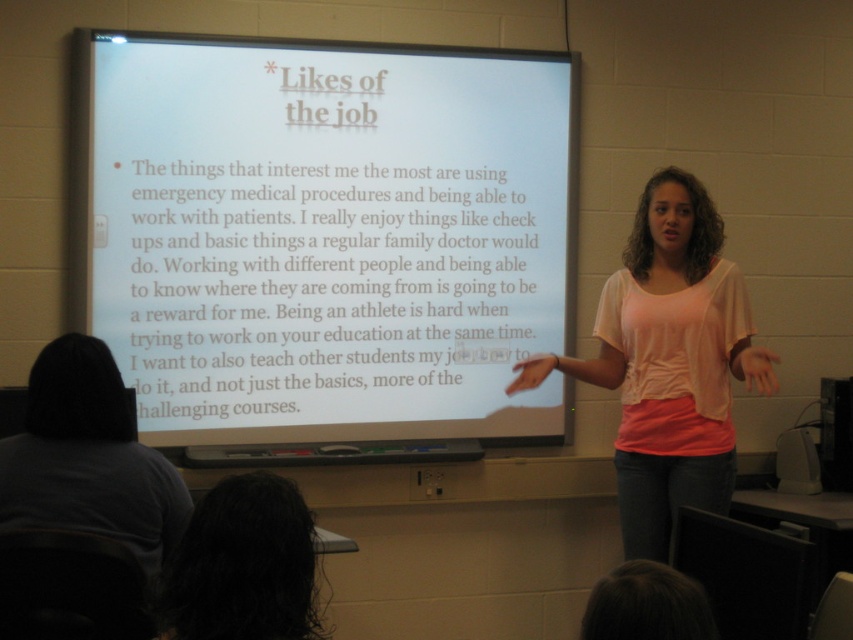
Question: Which of the following is the closest to the observer?

Choices:
 (A) pink cotton shirt at center
 (B) white matte projector screen at upper center

Answer: (A)

Question: Observing the image, what is the correct spatial positioning of gray cotton shirt at lower left in reference to dark curly hair at lower left?

Choices:
 (A) left
 (B) right

Answer: (A)

Question: Among these points, which one is nearest to the camera?

Choices:
 (A) (599, 356)
 (B) (213, 534)
 (C) (473, 388)

Answer: (B)

Question: Is gray cotton shirt at lower left further to the viewer compared to dark curly hair at lower left?

Choices:
 (A) no
 (B) yes

Answer: (B)

Question: Is the position of white matte projector screen at upper center more distant than that of pink cotton shirt at center?

Choices:
 (A) yes
 (B) no

Answer: (A)

Question: Which of the following is the farthest from the observer?

Choices:
 (A) (428, 243)
 (B) (151, 532)
 (C) (648, 237)
 (D) (250, 490)

Answer: (A)